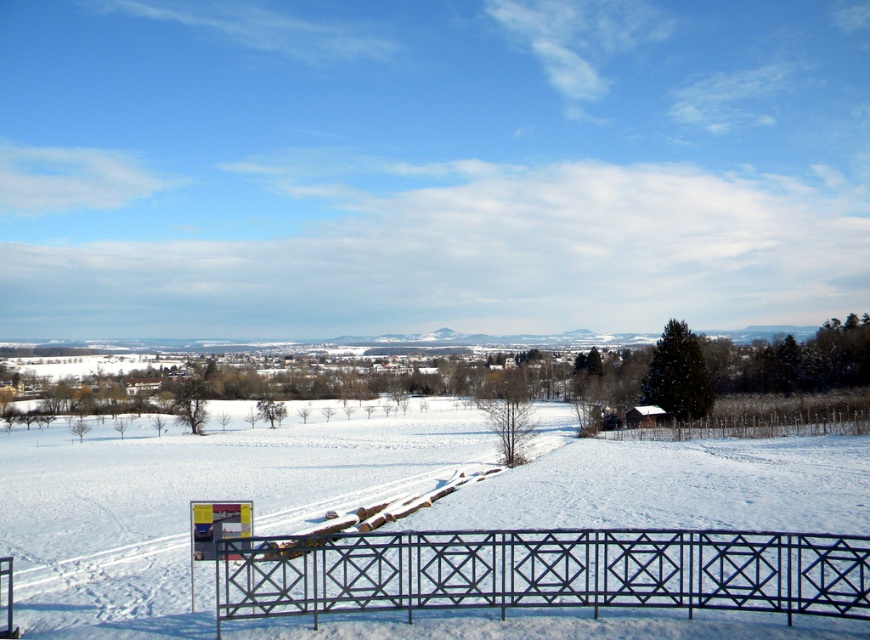
Question: Is white powdery snow at center positioned at the back of black metal fence at lower center?

Choices:
 (A) no
 (B) yes

Answer: (B)

Question: Does white powdery snow at center have a greater width compared to black metal fence at lower center?

Choices:
 (A) yes
 (B) no

Answer: (A)

Question: Which point appears farthest from the camera in this image?

Choices:
 (A) (768, 512)
 (B) (787, 596)

Answer: (A)

Question: Is white powdery snow at center positioned in front of black metal fence at lower center?

Choices:
 (A) no
 (B) yes

Answer: (A)

Question: Which object appears farthest from the camera in this image?

Choices:
 (A) white powdery snow at center
 (B) black metal fence at lower center

Answer: (A)

Question: Among these points, which one is nearest to the camera?

Choices:
 (A) (182, 502)
 (B) (270, 570)

Answer: (B)